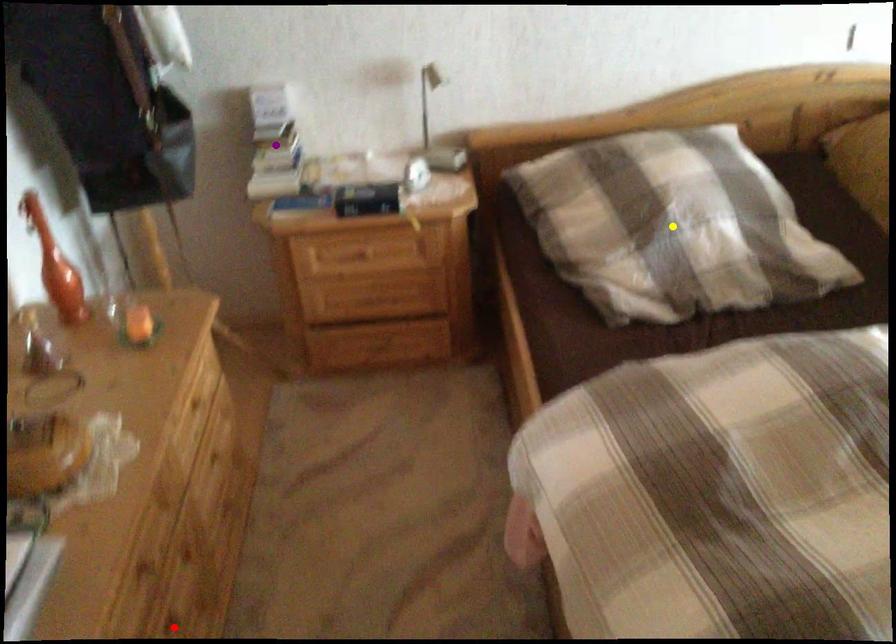
Order these from nearest to farthest:
red point | yellow point | purple point

red point → yellow point → purple point